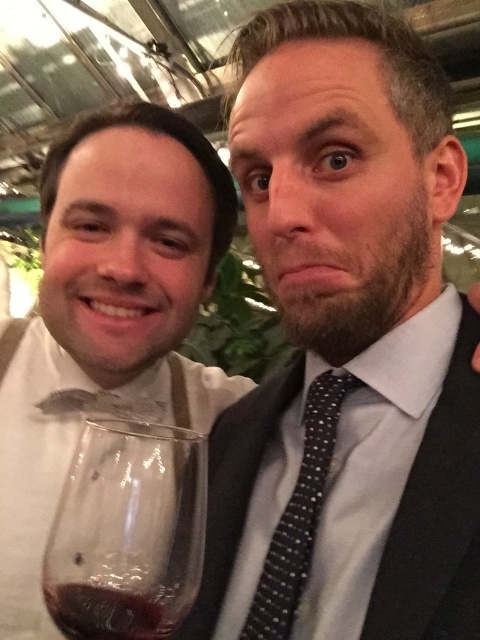
Question: Is black dotted tie at center closer to camera compared to dark red liquid at lower left?

Choices:
 (A) no
 (B) yes

Answer: (A)

Question: Can you confirm if transparent glass at lower left is wider than dark red liquid at lower left?

Choices:
 (A) no
 (B) yes

Answer: (B)

Question: Which of the following is the farthest from the observer?

Choices:
 (A) (275, 595)
 (B) (129, 593)
 (C) (148, 516)

Answer: (A)

Question: Which object is positioned farthest from the dark red liquid at lower left?

Choices:
 (A) black dotted tie at center
 (B) transparent glass at lower left
 (C) black textured suit at center

Answer: (C)

Question: Which of the following is the farthest from the observer?

Choices:
 (A) (336, 417)
 (B) (78, 634)
 (C) (81, 435)
 (D) (115, 413)

Answer: (D)

Question: Is the position of matte white bow tie at left more distant than that of transparent glass at lower left?

Choices:
 (A) yes
 (B) no

Answer: (A)